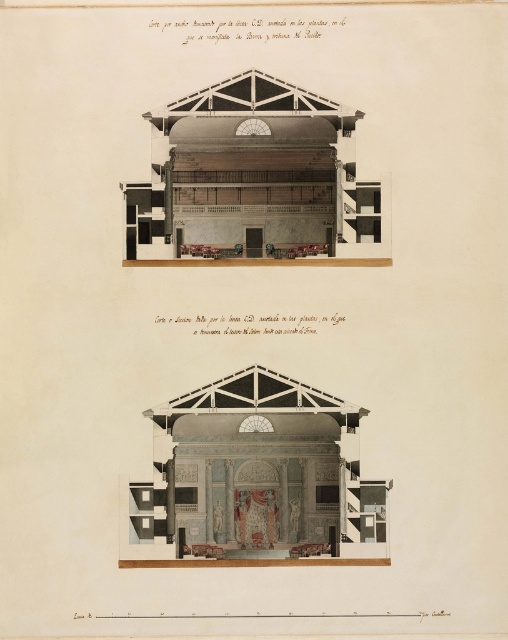
Question: Which of the following is the farthest from the observer?

Choices:
 (A) (184, 156)
 (B) (154, 552)

Answer: (A)

Question: Is matte gray marble stage at center wider than wooden paneling at center?

Choices:
 (A) no
 (B) yes

Answer: (B)

Question: Does matte gray marble stage at center come behind wooden paneling at center?

Choices:
 (A) yes
 (B) no

Answer: (B)

Question: Is matte gray marble stage at center positioned in front of wooden paneling at center?

Choices:
 (A) yes
 (B) no

Answer: (A)

Question: Which point is closer to the camera taking this photo?

Choices:
 (A) (138, 234)
 (B) (190, 394)

Answer: (B)